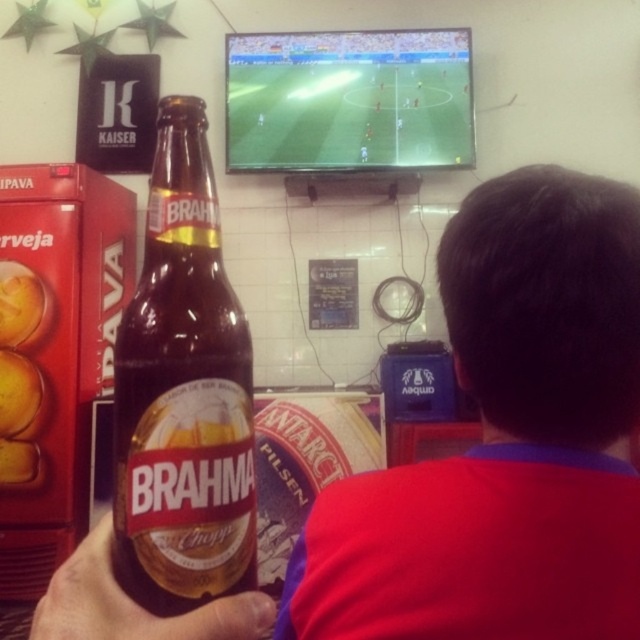
Question: Which of the following is the closest to the observer?

Choices:
 (A) (522, 624)
 (B) (250, 134)

Answer: (A)

Question: Can you confirm if matte glass bottle at center is bigger than green screen soccer field at upper center?

Choices:
 (A) yes
 (B) no

Answer: (A)

Question: Which object is closer to the camera taking this photo?

Choices:
 (A) matte glass bottle at center
 (B) green screen soccer field at upper center
 (C) brown glass bottle at center

Answer: (A)

Question: From the image, what is the correct spatial relationship of matte glass bottle at center in relation to brown glass bottle at center?

Choices:
 (A) left
 (B) right

Answer: (B)

Question: From the image, what is the correct spatial relationship of brown glass bottle at center in relation to green screen soccer field at upper center?

Choices:
 (A) above
 (B) below

Answer: (B)

Question: Which point is farther to the camera?

Choices:
 (A) (364, 36)
 (B) (220, 584)
 (C) (483, 556)

Answer: (A)